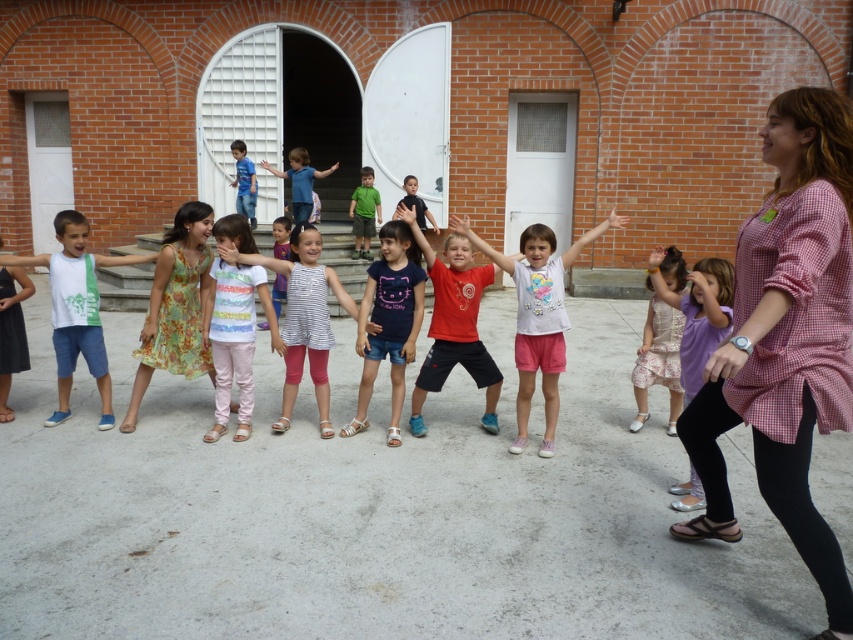
Question: Does dark blue jersey at center have a smaller size compared to blue denim jeans at center?

Choices:
 (A) no
 (B) yes

Answer: (B)

Question: Does pink floral dress at center appear under matte black shirt at center?

Choices:
 (A) no
 (B) yes

Answer: (B)

Question: Which point is closer to the camera?

Choices:
 (A) pink checkered shirt at center
 (B) floral dress at center

Answer: (A)

Question: Which point is closer to the camera taking this photo?

Choices:
 (A) (219, 296)
 (B) (247, 182)

Answer: (A)

Question: Which object is the closest to the matte black shirt at center?

Choices:
 (A) white cotton shirt at center
 (B) blue denim jeans at center
 (C) white cotton tank top at left

Answer: (B)

Question: Is the position of red matte shirt at center less distant than that of green matte shirt at center?

Choices:
 (A) yes
 (B) no

Answer: (A)